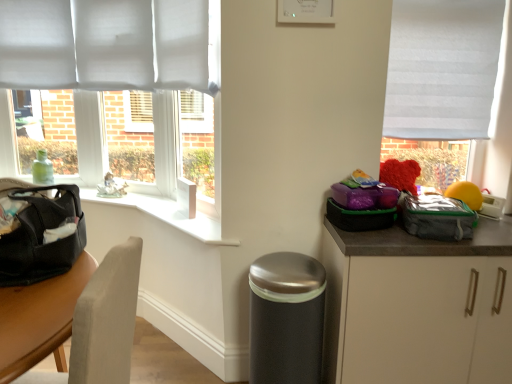
This screenshot has height=384, width=512. In order to click on gray fabric lunch bag at right in this screenshot , I will do `click(438, 217)`.

Which object is further away from the camera, yellow rubber ball at right or gray fabric lunch bag at right?

yellow rubber ball at right is further away from the camera.

Measure the distance between yellow rubber ball at right and gray fabric lunch bag at right.

yellow rubber ball at right is 31.92 centimeters from gray fabric lunch bag at right.

Is yellow rubber ball at right placed right next to gray fabric lunch bag at right?

No, yellow rubber ball at right is not in contact with gray fabric lunch bag at right.

From the image's perspective, which is above, yellow rubber ball at right or gray fabric lunch bag at right?

yellow rubber ball at right, from the image's perspective.

From a real-world perspective, is matte black bag at left positioned above or below gray fabric lunch bag at right?

From a real-world perspective, matte black bag at left is physically above gray fabric lunch bag at right.

Can you confirm if matte black bag at left is bigger than gray fabric lunch bag at right?

Yes, matte black bag at left is bigger than gray fabric lunch bag at right.

Does matte black bag at left come in front of gray fabric lunch bag at right?

Yes, it is.

Do you think matte black bag at left is within gray fabric lunch bag at right, or outside of it?

matte black bag at left is not enclosed by gray fabric lunch bag at right.

Consider the image. From a real-world perspective, which is physically below, white fabric window at right or white matte cabinet at lower right?

From a 3D spatial view, white matte cabinet at lower right is below.

Identify the location of window above the white matte cabinet at lower right (from the image's perspective). The image size is (512, 384). (463, 87).

How far apart are white fabric window at right and white matte cabinet at lower right?

white fabric window at right is 29.63 inches from white matte cabinet at lower right.

Is point (496, 53) positioned before point (400, 257)?

That is False.

Is satin silver trash can at lower center to the right of white fabric window at right from the viewer's perspective?

No, satin silver trash can at lower center is not to the right of white fabric window at right.

Between satin silver trash can at lower center and white fabric window at right, which one has less height?

With less height is satin silver trash can at lower center.

Looking at the image, does satin silver trash can at lower center seem bigger or smaller compared to white fabric window at right?

satin silver trash can at lower center is bigger than white fabric window at right.

Is satin silver trash can at lower center next to white fabric window at right?

They are not placed beside each other.

Between point (486, 198) and point (465, 256), which one is positioned in front?

Positioned in front is point (465, 256).

Which of these two, yellow rubber ball at right or white matte cabinet at lower right, is smaller?

yellow rubber ball at right.

From a real-world perspective, which object stands above the other?

In real-world perspective, yellow rubber ball at right is above.

Choose the correct answer: Is yellow rubber ball at right inside white matte cabinet at lower right or outside it?

The correct answer is: outside.

Are satin silver trash can at lower center and gray fabric lunch bag at right located far from each other?

Actually, satin silver trash can at lower center and gray fabric lunch bag at right are a little close together.

What's the angular difference between satin silver trash can at lower center and gray fabric lunch bag at right's facing directions?

The facing directions of satin silver trash can at lower center and gray fabric lunch bag at right are 0.000398 degrees apart.

Is satin silver trash can at lower center located outside gray fabric lunch bag at right?

satin silver trash can at lower center lies outside gray fabric lunch bag at right's area.

Which is more to the left, satin silver trash can at lower center or gray fabric lunch bag at right?

From the viewer's perspective, satin silver trash can at lower center appears more on the left side.

At what (x,y) coordinates should I click in order to perform the action: click on window located on the left of yellow rubber ball at right. Please return your answer as a coordinate pair (x, y). The height and width of the screenshot is (384, 512). Looking at the image, I should click on (463, 87).

Does yellow rubber ball at right have a greater height compared to white fabric window at right?

Incorrect, the height of yellow rubber ball at right is not larger of that of white fabric window at right.

Is the position of yellow rubber ball at right less distant than that of white fabric window at right?

A: That is True.

Looking at their sizes, would you say yellow rubber ball at right is wider or thinner than white fabric window at right?

yellow rubber ball at right is thinner than white fabric window at right.

At what (x,y) coordinates should I click in order to perform the action: click on kit above the yellow rubber ball at right (from a real-world perspective). Please return your answer as a coordinate pair (x, y). Looking at the image, I should click on (438, 217).

Image resolution: width=512 pixels, height=384 pixels. I want to click on kit behind the matte black bag at left, so click(x=438, y=217).

Estimate the real-world distances between objects in this image. Which object is further from white fabric window at right, gray fabric lunch bag at right or satin silver trash can at lower center?

The object further to white fabric window at right is satin silver trash can at lower center.

Estimate the real-world distances between objects in this image. Which object is further from matte black bag at left, white matte cabinet at lower right or yellow rubber ball at right?

yellow rubber ball at right.

Considering their positions, is white matte cabinet at lower right positioned further to matte black bag at left than gray fabric lunch bag at right?

gray fabric lunch bag at right is positioned further to the anchor matte black bag at left.

When comparing their distances from gray fabric lunch bag at right, does satin silver trash can at lower center or white fabric window at right seem further?

white fabric window at right lies further to gray fabric lunch bag at right than the other object.

Looking at the image, which one is located further to satin silver trash can at lower center, gray fabric lunch bag at right or yellow rubber ball at right?

Based on the image, yellow rubber ball at right appears to be further to satin silver trash can at lower center.

From the image, which object appears to be farther from matte black bag at left, white fabric window at right or white matte cabinet at lower right?

The object further to matte black bag at left is white fabric window at right.

Which object lies nearer to the anchor point satin silver trash can at lower center, yellow rubber ball at right or gray fabric lunch bag at right?

Among the two, gray fabric lunch bag at right is located nearer to satin silver trash can at lower center.

From the image, which object appears to be farther from yellow rubber ball at right, white fabric window at right or white matte cabinet at lower right?

white matte cabinet at lower right lies further to yellow rubber ball at right than the other object.

This screenshot has height=384, width=512. What are the coordinates of `window between matte black bag at left and yellow rubber ball at right from left to right` in the screenshot? It's located at (463, 87).

You are a GUI agent. You are given a task and a screenshot of the screen. Output one action in this format:
    pyautogui.click(x=<x>, y=<y>)
    Task: Click on the cabinetry between white fabric window at right and satin silver trash can at lower center vertically
    This screenshot has width=512, height=384.
    Given the screenshot: What is the action you would take?
    pyautogui.click(x=417, y=307)

Find the location of a particular element. kit between white fabric window at right and satin silver trash can at lower center vertically is located at coordinates [x=438, y=217].

At what (x,y) coordinates should I click in order to perform the action: click on kit between matte black bag at left and yellow rubber ball at right in the horizontal direction. Please return your answer as a coordinate pair (x, y). This screenshot has width=512, height=384. Looking at the image, I should click on (438, 217).